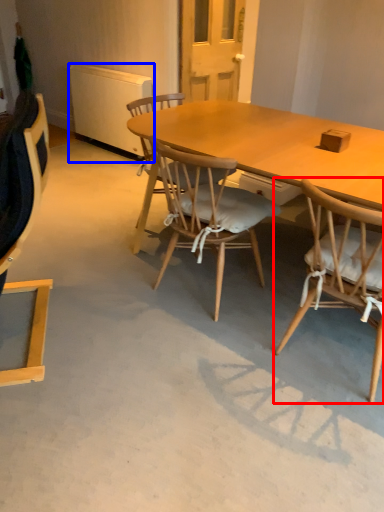
Question: Which of the following is the farthest to the observer, chair (highlighted by a red box) or radiator (highlighted by a blue box)?

Choices:
 (A) chair
 (B) radiator

Answer: (B)